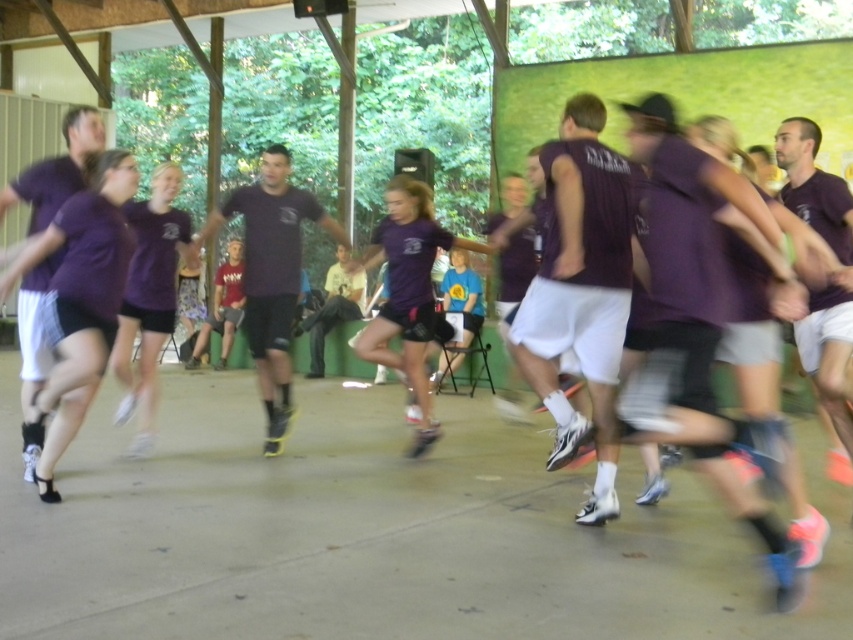
Question: Is purple matte shorts at left above purple matte shorts at center?

Choices:
 (A) yes
 (B) no

Answer: (A)

Question: Which of the following is the farthest from the observer?

Choices:
 (A) purple matte shorts at left
 (B) purple matte shorts at center

Answer: (B)

Question: Which point is farther to the camera?

Choices:
 (A) purple matte shorts at left
 (B) purple matte shorts at center

Answer: (B)

Question: Can you confirm if purple matte shorts at left is smaller than purple matte shorts at center?

Choices:
 (A) yes
 (B) no

Answer: (A)

Question: Is purple matte shorts at left smaller than purple matte shorts at center?

Choices:
 (A) no
 (B) yes

Answer: (B)